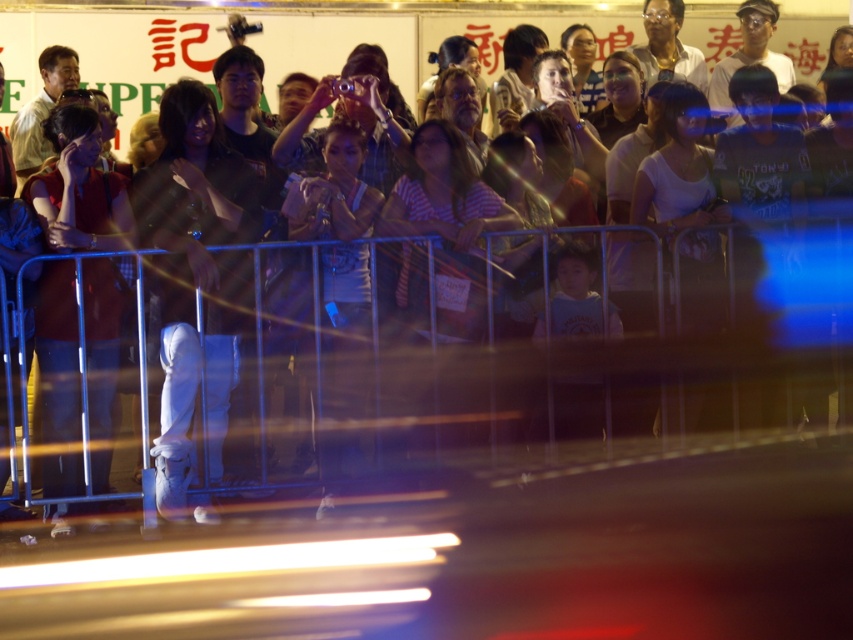
Does white leather boots at center appear on the right side of matte red shirt at center?

Correct, you'll find white leather boots at center to the right of matte red shirt at center.

Does point (189, 172) come in front of point (57, 461)?

That is True.

The image size is (853, 640). In order to click on white leather boots at center in this screenshot , I will do [194, 276].